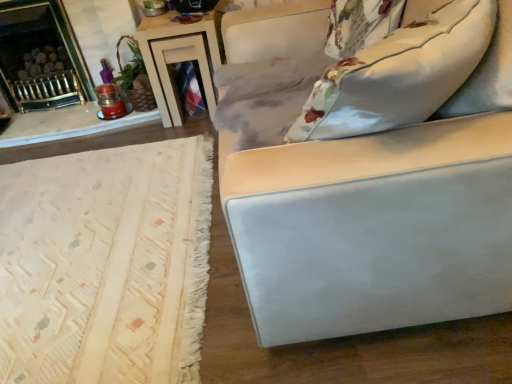
The image size is (512, 384). What do you see at coordinates (40, 57) in the screenshot? I see `brushed metal fireplace at upper left` at bounding box center [40, 57].

What do you see at coordinates (399, 74) in the screenshot?
I see `floral fabric pillow at upper right` at bounding box center [399, 74].

Identify the location of wooden table at upper center. (180, 57).

Identify the location of brushed metal fireplace at upper left. Image resolution: width=512 pixels, height=384 pixels. (40, 57).

Is brushed metal fireplace at upper left a part of floral fabric pillow at upper right?

No, brushed metal fireplace at upper left is located outside of floral fabric pillow at upper right.

Is floral fabric pillow at upper right looking in the opposite direction of brushed metal fireplace at upper left?

No, floral fabric pillow at upper right is not facing away from brushed metal fireplace at upper left.

From a real-world perspective, is floral fabric pillow at upper right positioned above or below brushed metal fireplace at upper left?

floral fabric pillow at upper right is situated higher than brushed metal fireplace at upper left in the real world.

Does floral fabric pillow at upper right lie behind brushed metal fireplace at upper left?

No, it is not.

From the picture: From a real-world perspective, is brushed metal fireplace at upper left physically below wooden table at upper center?

Incorrect, from a real-world perspective, brushed metal fireplace at upper left is higher than wooden table at upper center.

From the image's perspective, is brushed metal fireplace at upper left located above or below wooden table at upper center?

brushed metal fireplace at upper left is situated higher than wooden table at upper center in the image.

You are a GUI agent. You are given a task and a screenshot of the screen. Output one action in this format:
    pyautogui.click(x=<x>, y=<y>)
    Task: Click on the table directly beneath the brushed metal fireplace at upper left (from a real-world perspective)
    The height and width of the screenshot is (384, 512).
    Given the screenshot: What is the action you would take?
    pyautogui.click(x=180, y=57)

Do you think brushed metal fireplace at upper left is within wooden table at upper center, or outside of it?

The correct answer is: outside.

Who is smaller, brushed metal fireplace at upper left or floral fabric pillow at upper right?

Smaller between the two is floral fabric pillow at upper right.

Considering the sizes of brushed metal fireplace at upper left and floral fabric pillow at upper right in the image, is brushed metal fireplace at upper left wider or thinner than floral fabric pillow at upper right?

brushed metal fireplace at upper left is wider than floral fabric pillow at upper right.

Is wooden table at upper center surrounded by floral fabric pillow at upper right?

No, wooden table at upper center is located outside of floral fabric pillow at upper right.

Is floral fabric pillow at upper right taller than wooden table at upper center?

No, floral fabric pillow at upper right is not taller than wooden table at upper center.

Where is `pillow that is above the wooden table at upper center (from a real-world perspective)`? Image resolution: width=512 pixels, height=384 pixels. pillow that is above the wooden table at upper center (from a real-world perspective) is located at coordinates (399, 74).

Can you tell me how much floral fabric pillow at upper right and wooden table at upper center differ in facing direction?

There is a 82.6-degree angle between the facing directions of floral fabric pillow at upper right and wooden table at upper center.

Find the location of a particular element. This screenshot has width=512, height=384. pillow in front of the wooden table at upper center is located at coordinates (399, 74).

Is wooden table at upper center spatially inside floral fabric pillow at upper right, or outside of it?

wooden table at upper center is not enclosed by floral fabric pillow at upper right.

Is point (216, 47) behind point (355, 100)?

That is True.

Relative to floral fabric pillow at upper right, is wooden table at upper center in front or behind?

wooden table at upper center is behind floral fabric pillow at upper right.

Is wooden table at upper center oriented away from brushed metal fireplace at upper left?

No, wooden table at upper center is not facing away from brushed metal fireplace at upper left.

Does wooden table at upper center have a smaller size compared to brushed metal fireplace at upper left?

Yes.

Can you confirm if wooden table at upper center is wider than brushed metal fireplace at upper left?

Yes, wooden table at upper center is wider than brushed metal fireplace at upper left.

Is wooden table at upper center behind brushed metal fireplace at upper left?

No, the depth of wooden table at upper center is less than that of brushed metal fireplace at upper left.

Identify the location of pillow on the right of brushed metal fireplace at upper left. (399, 74).

At what (x,y) coordinates should I click in order to perform the action: click on table below the brushed metal fireplace at upper left (from the image's perspective). Please return your answer as a coordinate pair (x, y). This screenshot has width=512, height=384. Looking at the image, I should click on (180, 57).

Estimate the real-world distances between objects in this image. Which object is closer to floral fabric pillow at upper right, wooden table at upper center or brushed metal fireplace at upper left?

wooden table at upper center is closer to floral fabric pillow at upper right.

From the image, which object appears to be farther from wooden table at upper center, floral fabric pillow at upper right or brushed metal fireplace at upper left?

floral fabric pillow at upper right.

Estimate the real-world distances between objects in this image. Which object is closer to wooden table at upper center, brushed metal fireplace at upper left or floral fabric pillow at upper right?

brushed metal fireplace at upper left is positioned closer to the anchor wooden table at upper center.

When comparing their distances from floral fabric pillow at upper right, does brushed metal fireplace at upper left or wooden table at upper center seem closer?

Among the two, wooden table at upper center is located nearer to floral fabric pillow at upper right.

Based on their spatial positions, is wooden table at upper center or floral fabric pillow at upper right closer to brushed metal fireplace at upper left?

wooden table at upper center.

Estimate the real-world distances between objects in this image. Which object is further from brushed metal fireplace at upper left, floral fabric pillow at upper right or wooden table at upper center?

Among the two, floral fabric pillow at upper right is located further to brushed metal fireplace at upper left.

Locate an element on the screen. table between brushed metal fireplace at upper left and floral fabric pillow at upper right from left to right is located at coordinates (180, 57).